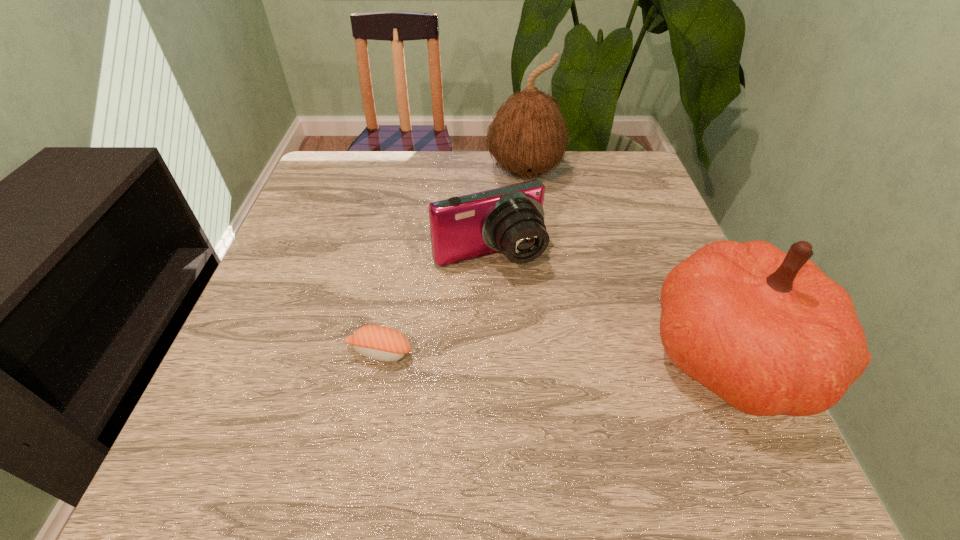
This screenshot has width=960, height=540. What are the coordinates of `free space on the desktop that is between the shortest object and the pumpkin and is positioned on the surface of the farthest object` in the screenshot? It's located at (582, 353).

Identify the location of free spot on the desktop that is between the shortest object and the third shortest object and is positioned on the front-facing side of the camera. (542, 353).